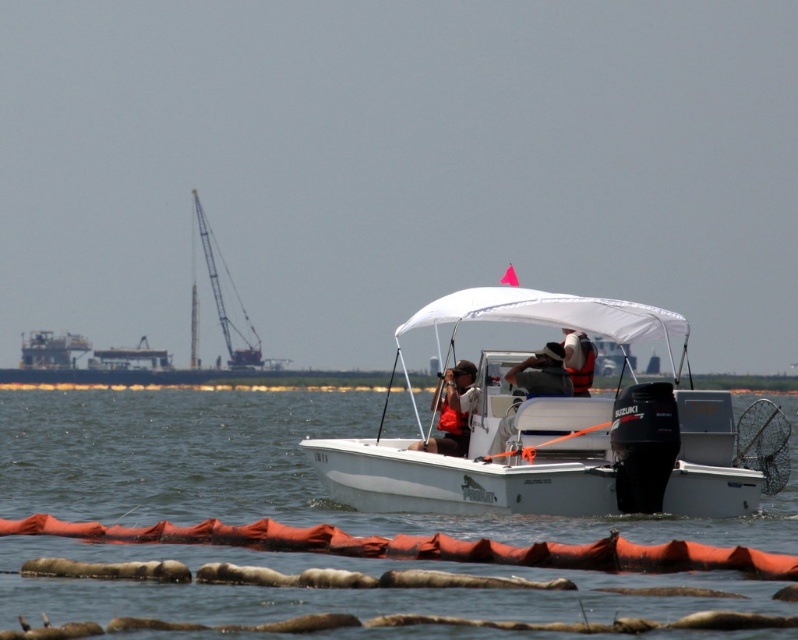
Can you confirm if matte orange life vest at center is shorter than orange life vest at center?

In fact, matte orange life vest at center may be taller than orange life vest at center.

This screenshot has width=798, height=640. What do you see at coordinates (451, 410) in the screenshot?
I see `matte orange life vest at center` at bounding box center [451, 410].

Identify the location of matte orange life vest at center. Image resolution: width=798 pixels, height=640 pixels. (451, 410).

At what (x,y) coordinates should I click in order to perform the action: click on white matte boat at center. Please return your answer as a coordinate pair (x, y). The image size is (798, 640). Looking at the image, I should click on (555, 429).

Between white matte boat at center and matte orange life vest at center, which one has more height?

With more height is white matte boat at center.

Who is more forward, [662,502] or [437,378]?

Positioned in front is point [662,502].

This screenshot has width=798, height=640. What are the coordinates of `white matte boat at center` in the screenshot? It's located at (555, 429).

Between orange life vest at center and white life vest at center, which one appears on the right side from the viewer's perspective?

Positioned to the right is white life vest at center.

Where is `orange life vest at center`? Image resolution: width=798 pixels, height=640 pixels. orange life vest at center is located at coordinates (542, 372).

I want to click on orange life vest at center, so click(x=542, y=372).